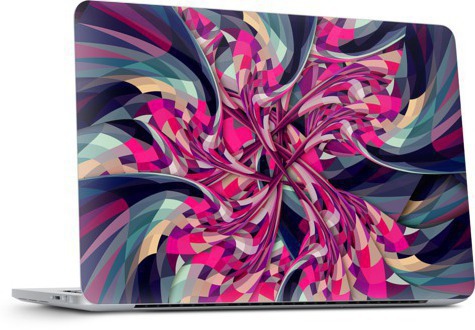
Find the location of `bottom of laptop`. bottom of laptop is located at coordinates (86, 311).